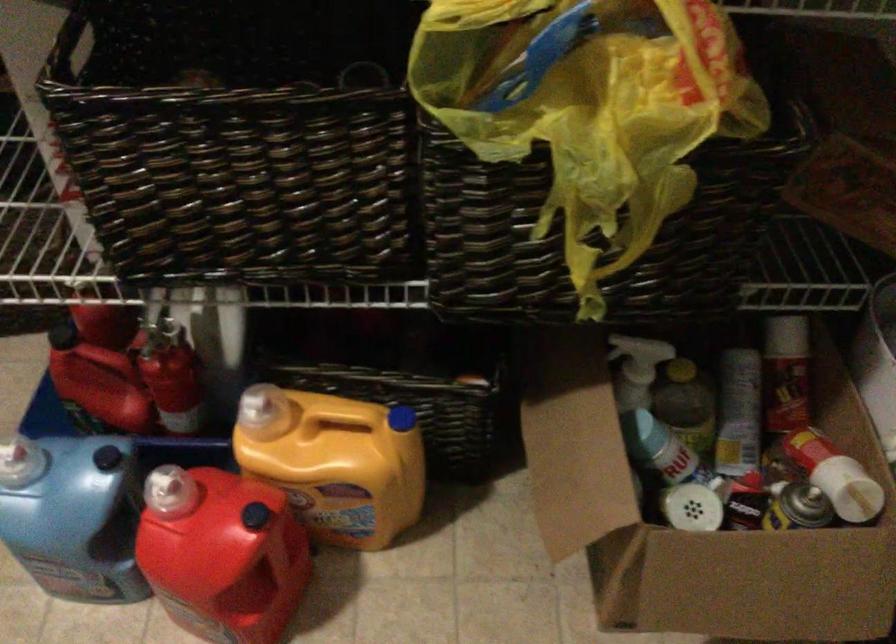
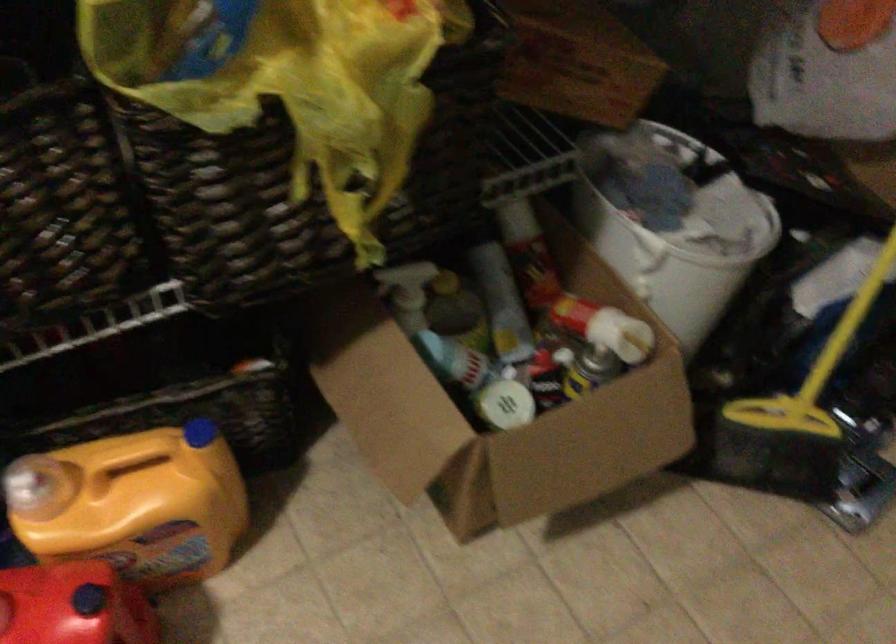
In the second image, find the point that corresponds to [590,137] in the first image.

(323, 84)